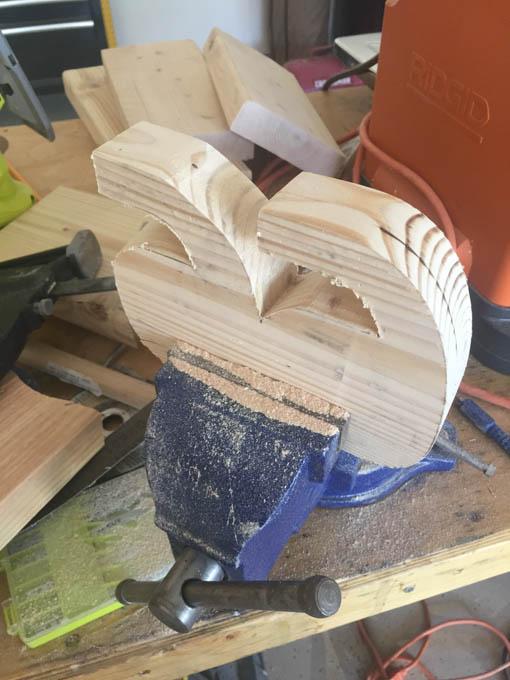
At what (x,y) coordinates should I click in order to perform the action: click on wall. Please return your answer as a coordinate pair (x, y). The image size is (510, 680). Looking at the image, I should click on (294, 18).